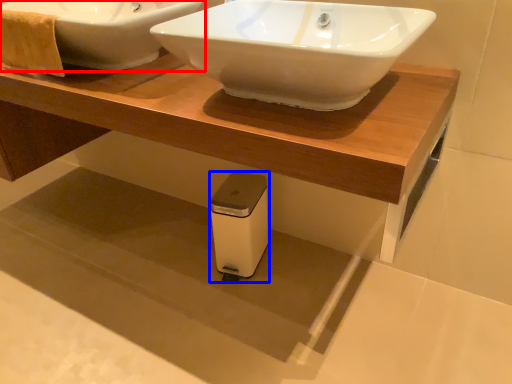
Question: Which of the following is the farthest to the observer, sink (highlighted by a red box) or appliance (highlighted by a blue box)?

Choices:
 (A) sink
 (B) appliance

Answer: (B)